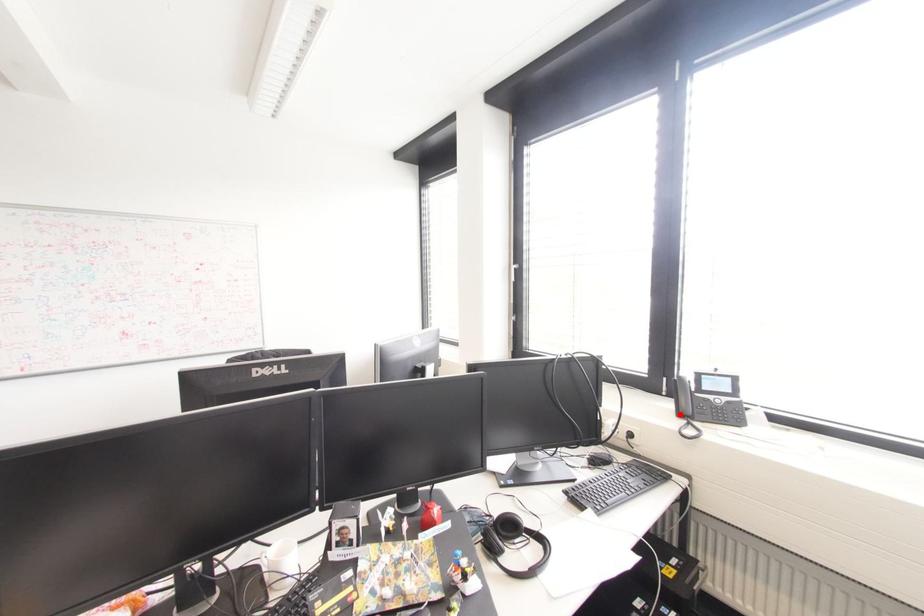
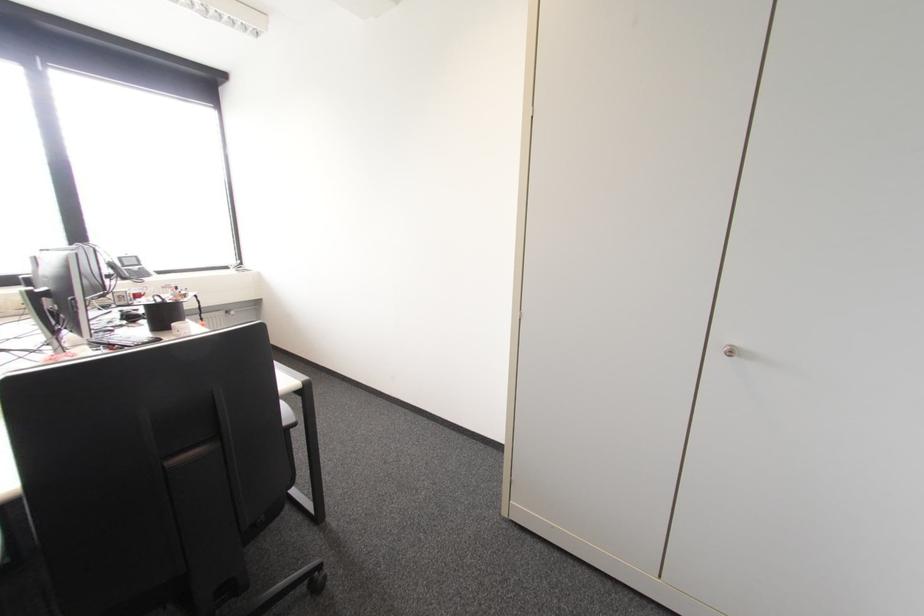
Where in the second image is the point corresponding to the highlighted location from the first image?

(123, 278)